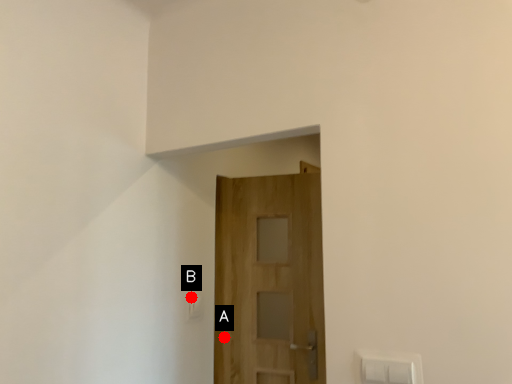
Question: Two points are circled on the image, labeled by A and B beside each circle. Which point appears closest to the camera in this image?

Choices:
 (A) A is closer
 (B) B is closer

Answer: (B)